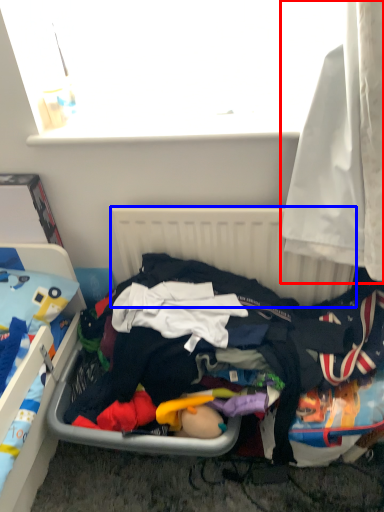
Question: Among these objects, which one is farthest to the camera, curtain (highlighted by a red box) or radiator (highlighted by a blue box)?

Choices:
 (A) curtain
 (B) radiator

Answer: (B)